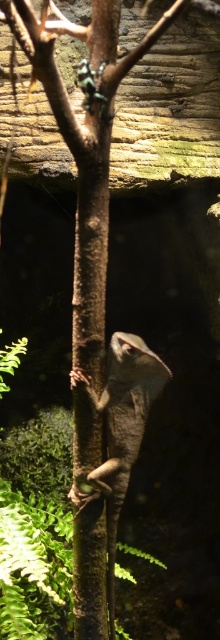
Based on the scene description, where is the brown rough tree trunk at center located in the image?

The brown rough tree trunk at center is located at point (91, 257).

You are a photographer trying to capture the brown rough tree trunk at center and the brown textured lizard at center in the same frame. Since both are brown, which object will appear larger in your photo?

The brown rough tree trunk at center will appear larger in the photo because it is bigger than the brown textured lizard at center.